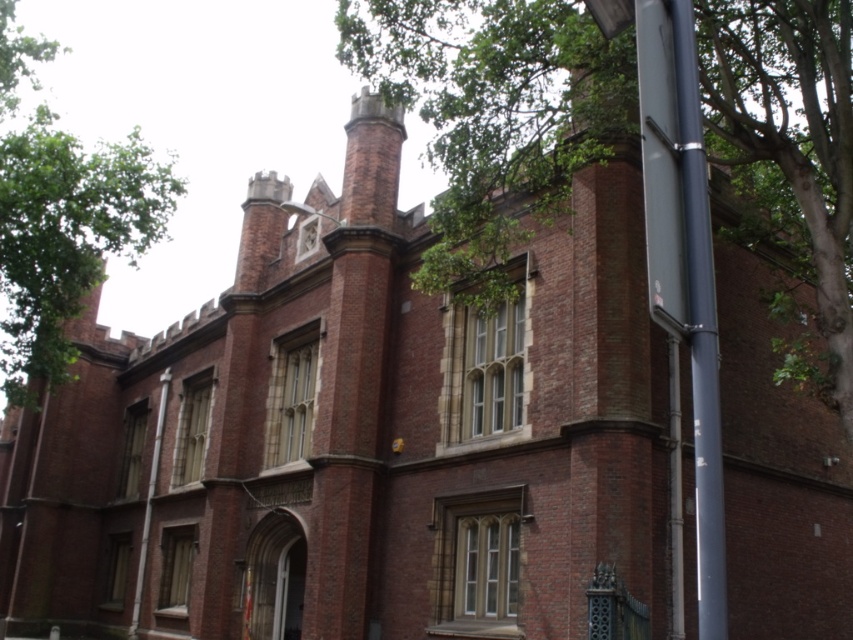
Does point (7, 298) lie in front of point (701, 448)?

No, (7, 298) is further to viewer.

Is green leafy tree at upper left shorter than smooth metallic pole at right?

Incorrect, green leafy tree at upper left's height does not fall short of smooth metallic pole at right's.

Where is `green leafy tree at upper left`? green leafy tree at upper left is located at coordinates (67, 236).

Is green leafy tree at upper right below smooth metallic pole at right?

No.

Who is taller, green leafy tree at upper right or smooth metallic pole at right?

green leafy tree at upper right is taller.

The width and height of the screenshot is (853, 640). I want to click on green leafy tree at upper right, so click(495, 106).

Where is `green leafy tree at upper right`? green leafy tree at upper right is located at coordinates (495, 106).

Is green leafy tree at upper right wider than green leafy tree at upper left?

No.

Is green leafy tree at upper right to the right of green leafy tree at upper left from the viewer's perspective?

Indeed, green leafy tree at upper right is positioned on the right side of green leafy tree at upper left.

Is point (766, 13) behind point (7, 84)?

No, it is not.

At what (x,y) coordinates should I click in order to perform the action: click on green leafy tree at upper right. Please return your answer as a coordinate pair (x, y). This screenshot has width=853, height=640. Looking at the image, I should click on (495, 106).